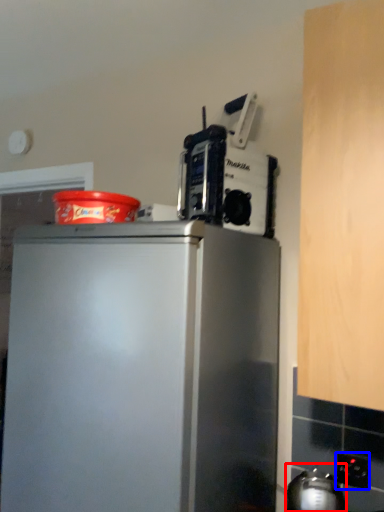
Question: Which object appears closest to the camera in this image, appliance (highlighted by a red box) or electric outlet (highlighted by a blue box)?

Choices:
 (A) appliance
 (B) electric outlet

Answer: (A)